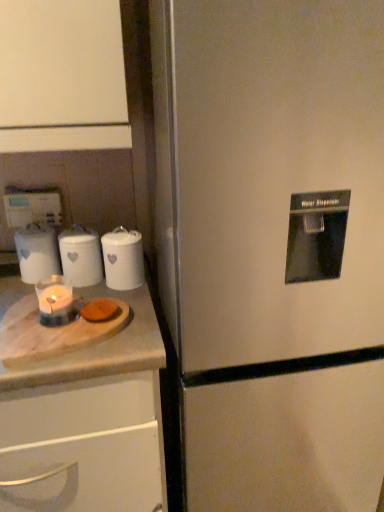
Identify the location of empty space that is ontop of white marble tray at left (from a real-world perspective). (44, 327).